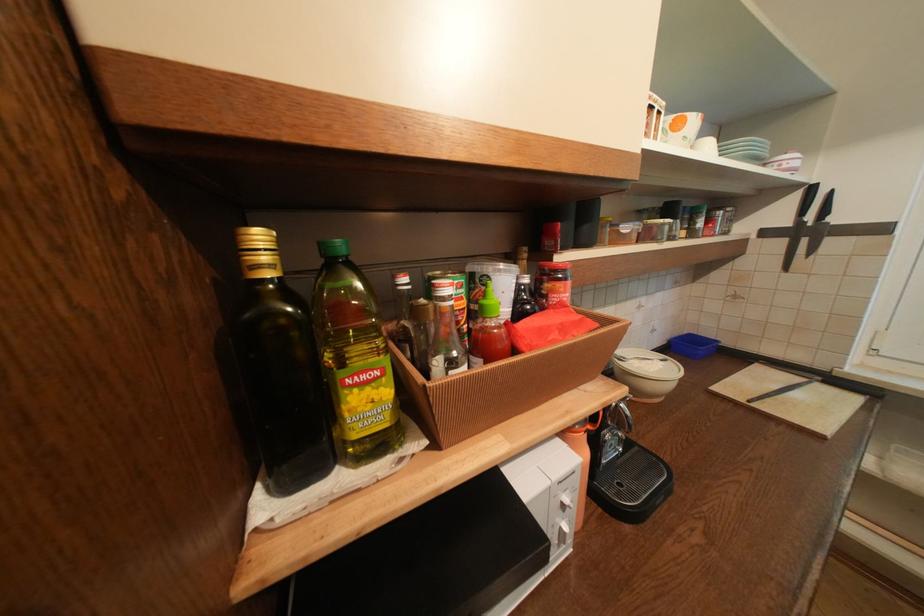
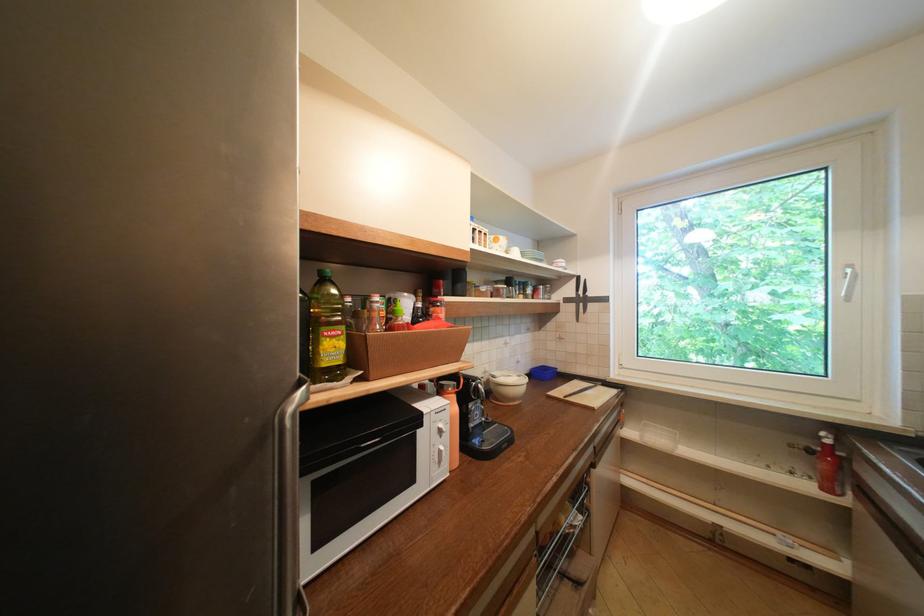
The point at (379, 377) is marked in the first image. Where is the corresponding point in the second image?

(345, 334)